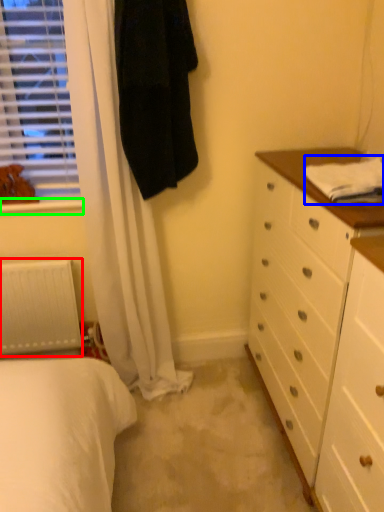
Question: Which object is positioned farthest from radiator (highlighted by a red box)? Select from sheet (highlighted by a blue box) and window sill (highlighted by a green box).

Choices:
 (A) sheet
 (B) window sill

Answer: (A)